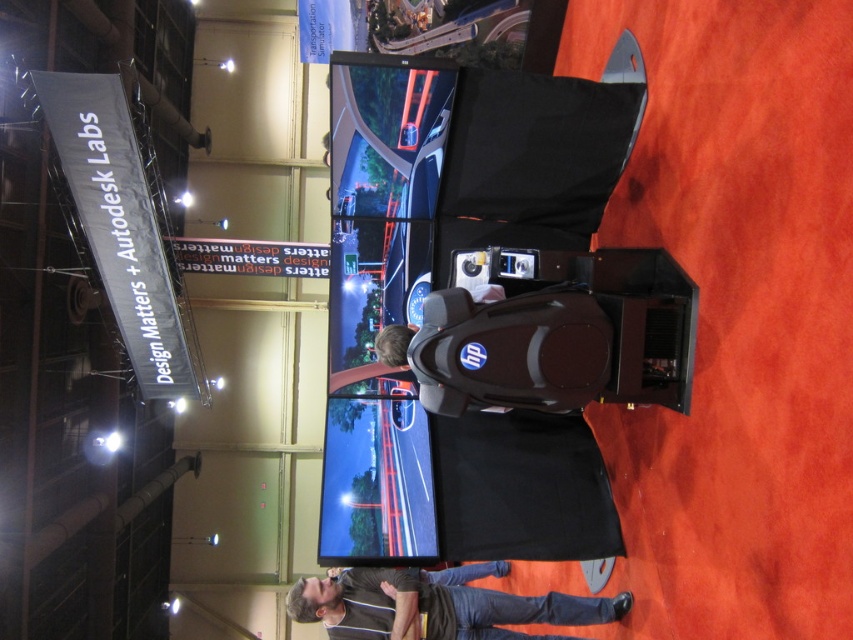
Question: Can you confirm if black plastic chair at center is smaller than dark gray shirt at center?

Choices:
 (A) no
 (B) yes

Answer: (B)

Question: Among these objects, which one is nearest to the camera?

Choices:
 (A) black plastic chair at center
 (B) dark gray shirt at center

Answer: (A)

Question: Can you confirm if black plastic chair at center is smaller than dark gray shirt at center?

Choices:
 (A) no
 (B) yes

Answer: (B)

Question: Does black plastic chair at center have a lesser width compared to dark gray shirt at center?

Choices:
 (A) no
 (B) yes

Answer: (B)

Question: Among these objects, which one is farthest from the camera?

Choices:
 (A) black plastic chair at center
 (B) dark gray shirt at center

Answer: (B)